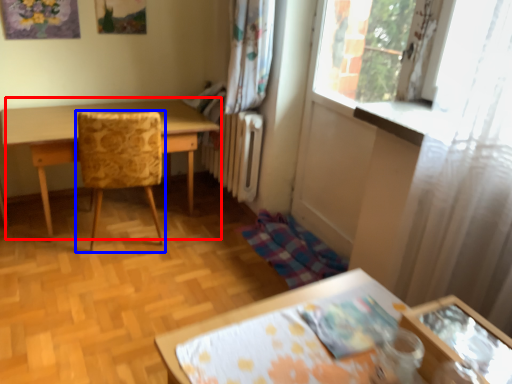
Question: Which of the following is the farthest to the observer, table (highlighted by a red box) or chair (highlighted by a blue box)?

Choices:
 (A) table
 (B) chair

Answer: (A)